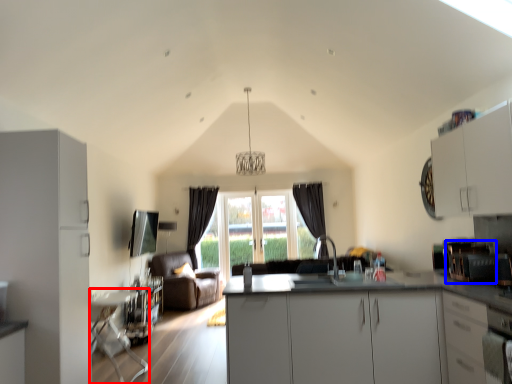
Question: Which object is further to the camera taking this photo, table (highlighted by a red box) or appliance (highlighted by a blue box)?

Choices:
 (A) table
 (B) appliance

Answer: (A)